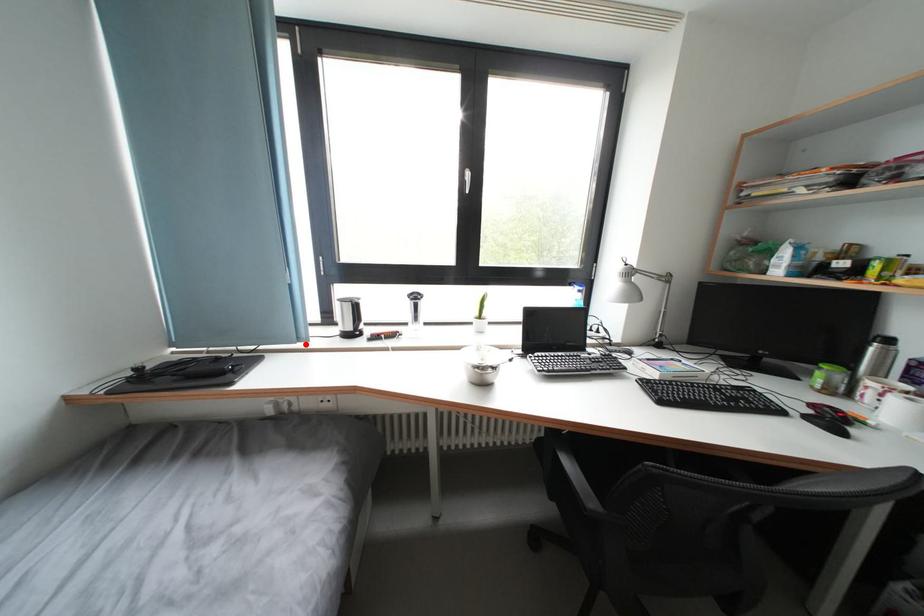
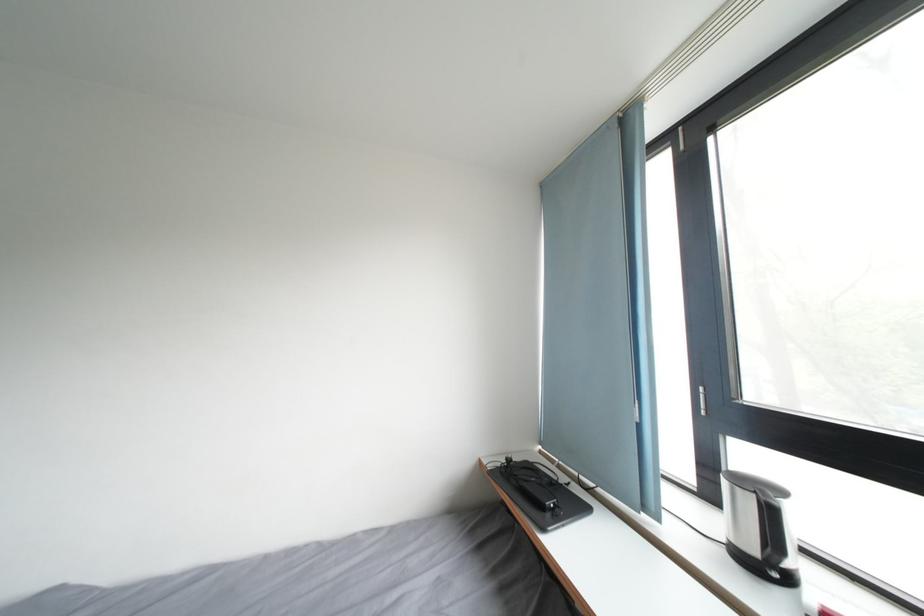
Locate, in the second image, the point that corresponds to the highlighted location in the first image.

(651, 514)